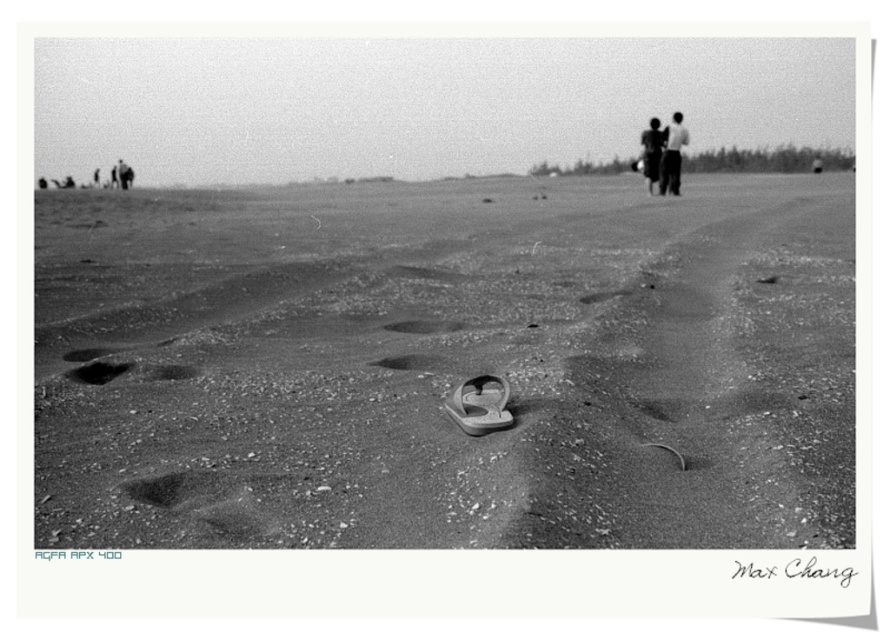
You are standing on the beach and notice two areas of sand. One is a dark sand footprint at lower left and the other is smooth sand at center. Which area is closer to the left side of the beach?

The dark sand footprint at lower left is closer to the left side of the beach because it is positioned to the left of the smooth sand at center.